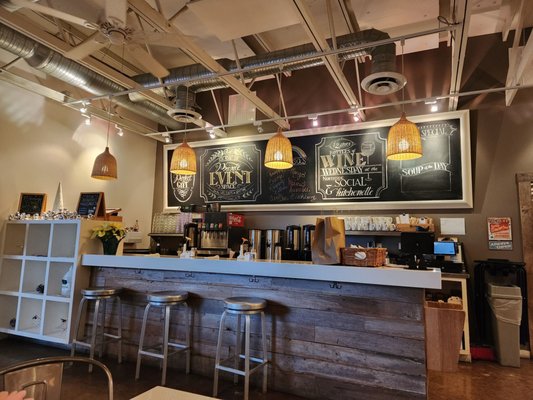
Identify the location of shelves. The width and height of the screenshot is (533, 400). point(18,257), point(18,295), point(46,298), point(48,258), point(48,341), point(8,328).